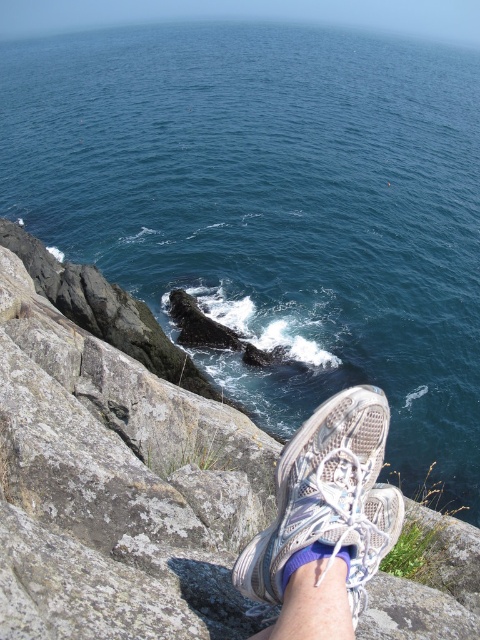
You are standing on the cliff and want to place a small backpack between the gray rock cliff at lower left and the white mesh shoe at lower center. Based on their sizes, which object should you place the backpack closer to?

The gray rock cliff at lower left has a larger width than the white mesh shoe at lower center, so you should place the backpack closer to the gray rock cliff at lower left to ensure there is enough space.

You are standing on the cliff and want to place a small backpack between the gray rock cliff at lower left and the white mesh shoe at lower center. Based on their sizes, which object should you use as a reference point to ensure the backpack fits properly?

The gray rock cliff at lower left is larger in size than the white mesh shoe at lower center, so you should use the gray rock cliff at lower left as the reference point to ensure the backpack fits properly.